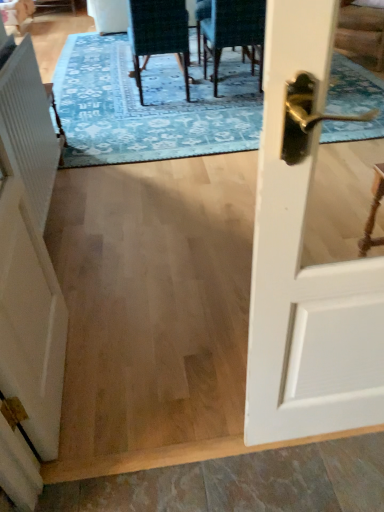
This screenshot has width=384, height=512. In order to click on vacant location below white matte barn door at left (from a real-world perspective) in this screenshot , I will do (70, 378).